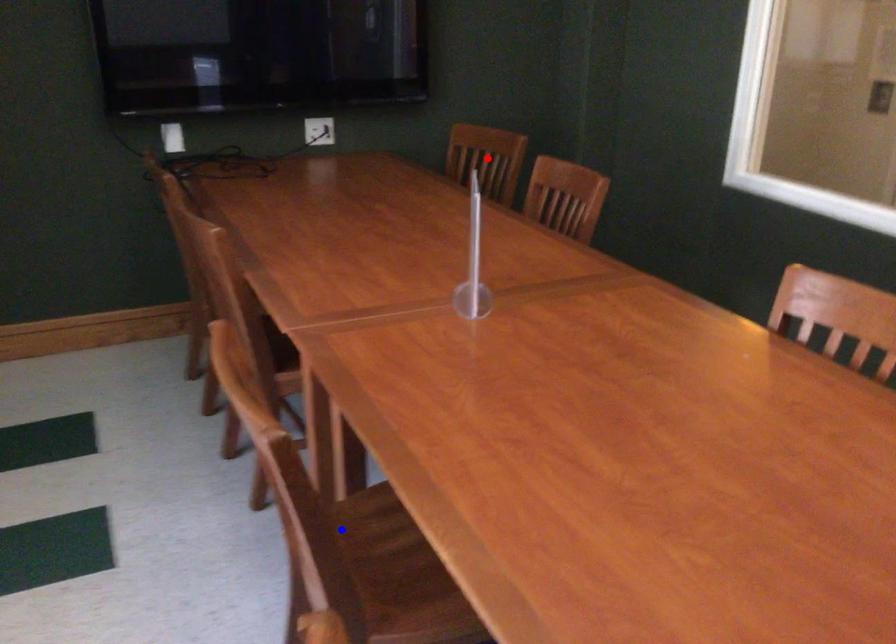
Question: Two points are marked on the image. Which point is closer to the camera?

Choices:
 (A) Blue point is closer.
 (B) Red point is closer.

Answer: (A)